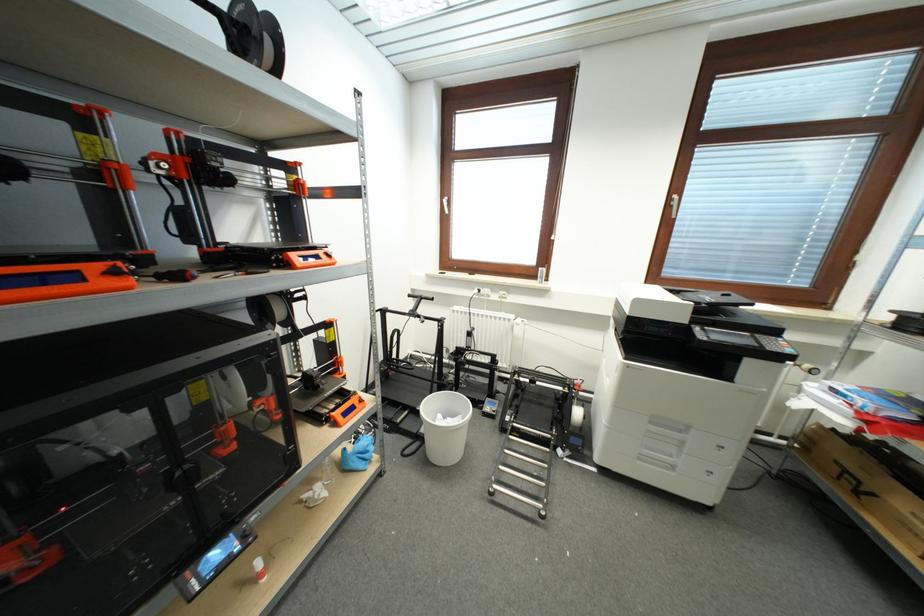
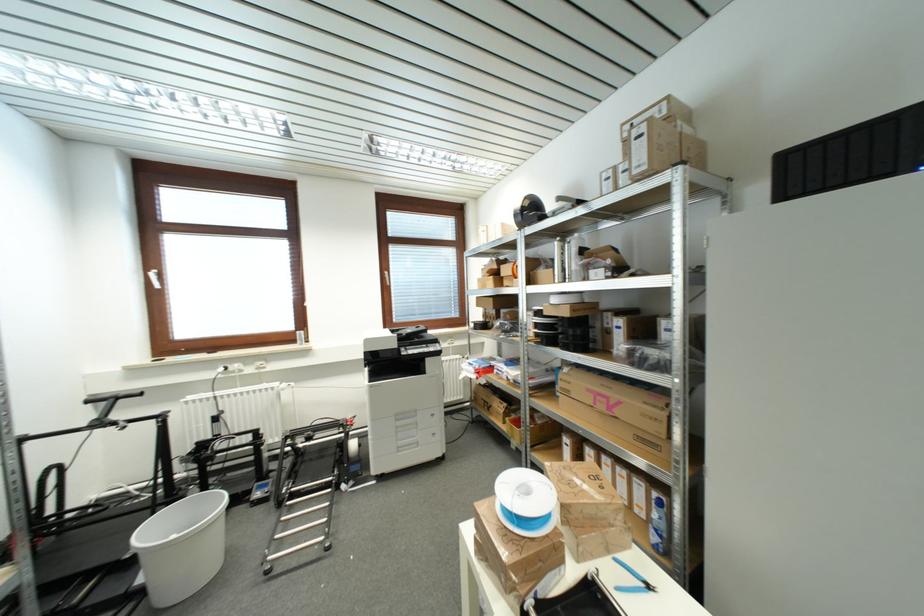
Find the pixel in the second image that matches point 427,434 in the first image.

(144, 582)